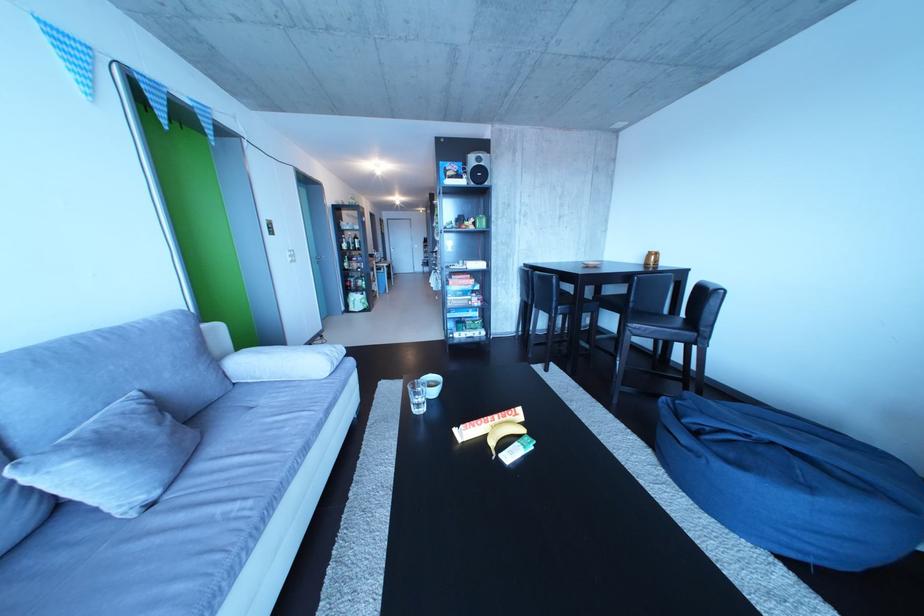
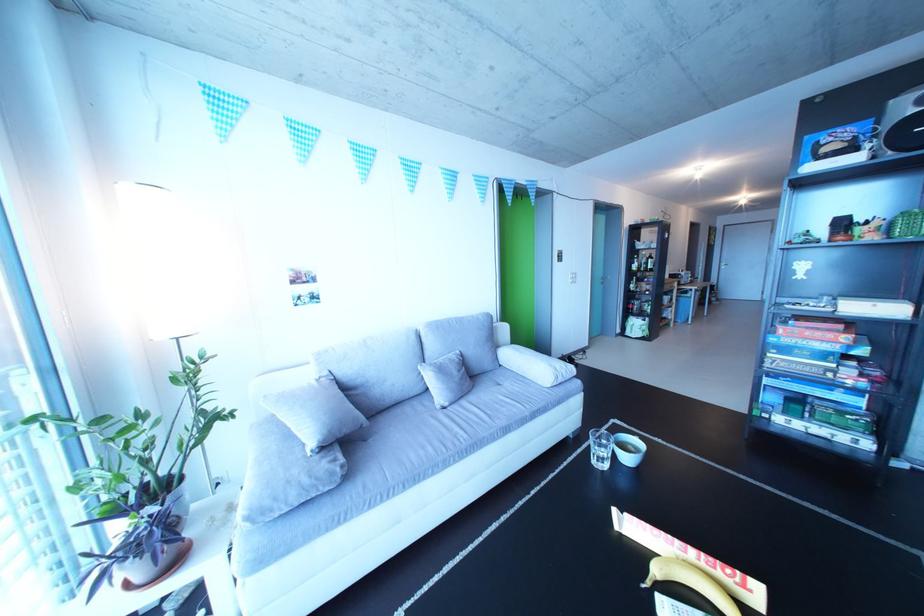
Locate, in the second image, the point that corresponds to (x=429, y=400) in the first image.

(614, 451)